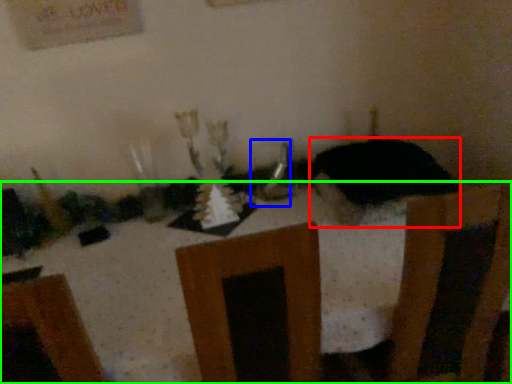
Question: Considering the real-world distances, which object is closest to animal (highlighted by a red box)? tableware (highlighted by a blue box) or furniture (highlighted by a green box).

Choices:
 (A) tableware
 (B) furniture

Answer: (A)